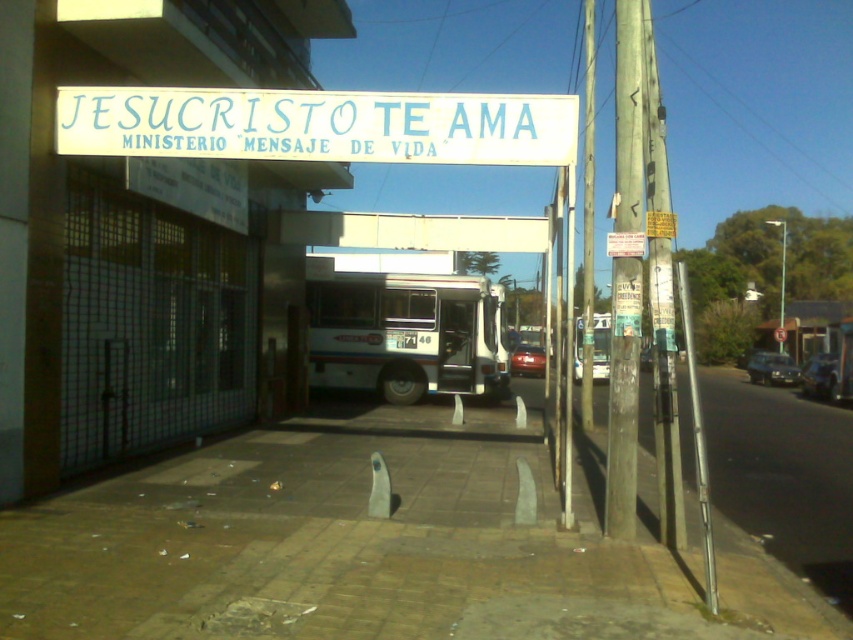
Question: Does white plastic bus stop at center appear on the left side of shiny silver sedan at right?

Choices:
 (A) yes
 (B) no

Answer: (A)

Question: Which object is positioned farthest from the metallic silver sedan at center?

Choices:
 (A) metallic silver van at center
 (B) white matte bus at center

Answer: (B)

Question: Which point is closer to the camera taking this photo?

Choices:
 (A) (747, 364)
 (B) (577, 372)

Answer: (B)

Question: Does shiny silver sedan at right lie in front of metallic silver van at center?

Choices:
 (A) yes
 (B) no

Answer: (B)

Question: Is brown brick pavement at center to the left of metallic silver van at center from the viewer's perspective?

Choices:
 (A) no
 (B) yes

Answer: (B)

Question: Which object is farther from the camera taking this photo?

Choices:
 (A) shiny silver sedan at right
 (B) metallic silver sedan at center
 (C) brown brick pavement at center

Answer: (B)